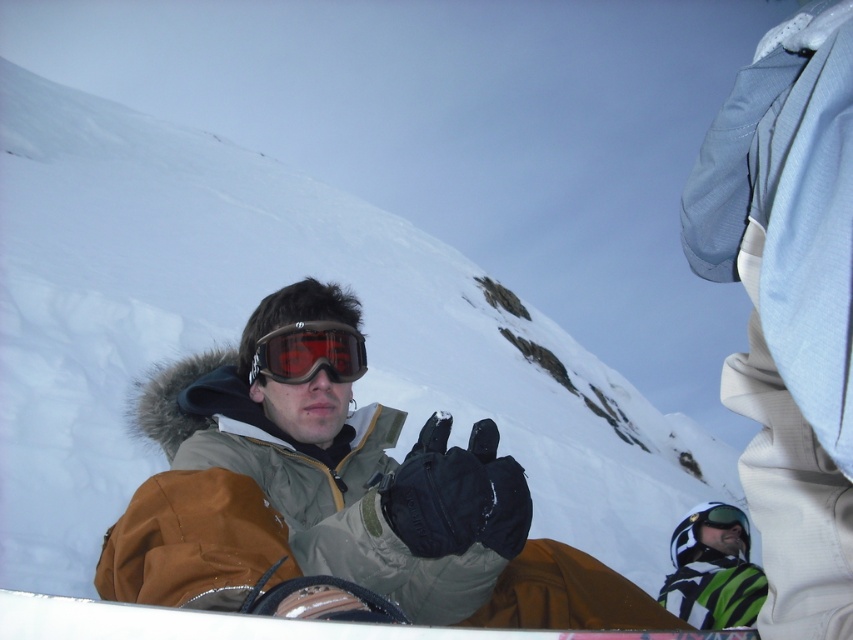
Can you confirm if brown leather snowboard at lower center is positioned to the left of matte black goggles at center?

Incorrect, brown leather snowboard at lower center is not on the left side of matte black goggles at center.

Measure the distance between brown leather snowboard at lower center and matte black goggles at center.

brown leather snowboard at lower center is 12.50 meters away from matte black goggles at center.

Locate an element on the screen. brown leather snowboard at lower center is located at coordinates (251, 625).